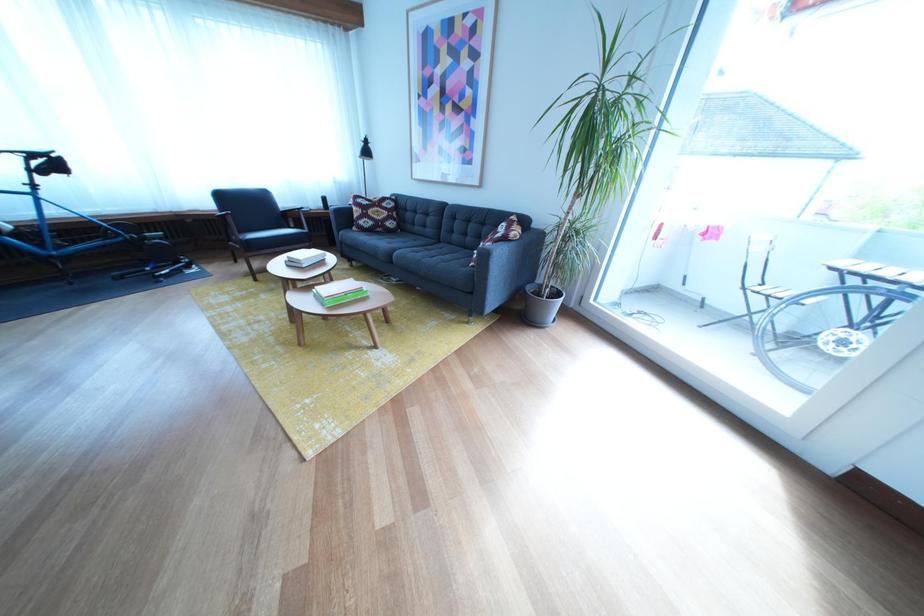
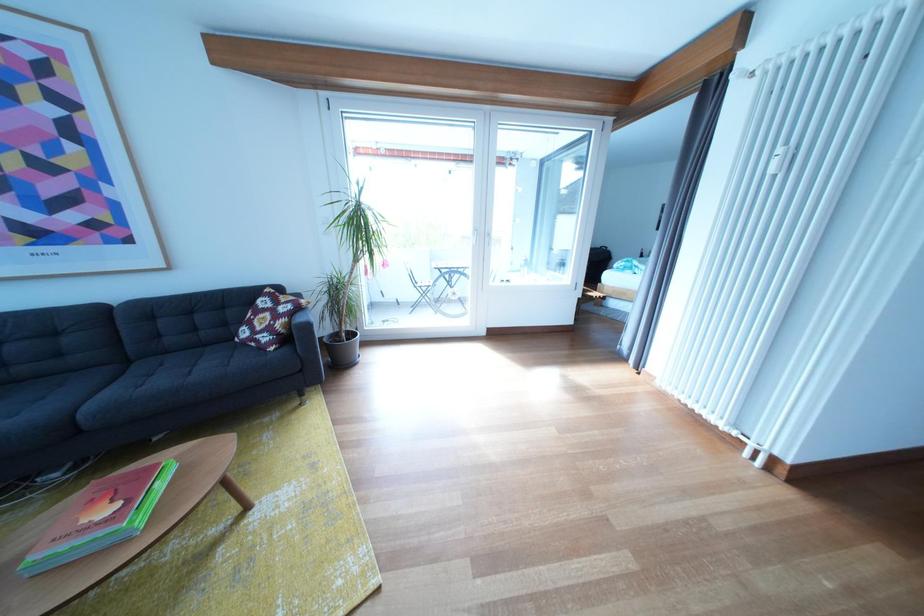
Locate, in the second image, the point that corresponds to [502,251] in the first image.

(296, 326)